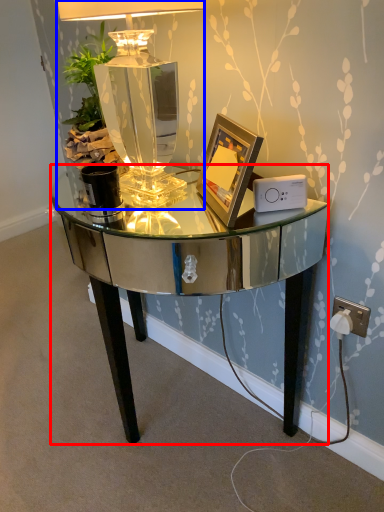
Question: Which object is further to the camera taking this photo, desk (highlighted by a red box) or lamp (highlighted by a blue box)?

Choices:
 (A) desk
 (B) lamp

Answer: (B)